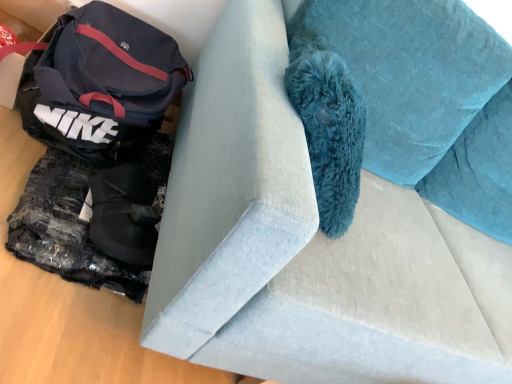
Question: From a real-world perspective, is matte black bag at left beneath suede couch at center?

Choices:
 (A) no
 (B) yes

Answer: (B)

Question: Is matte black bag at left not close to suede couch at center?

Choices:
 (A) yes
 (B) no

Answer: (B)

Question: From a real-world perspective, is matte black bag at left positioned over suede couch at center based on gravity?

Choices:
 (A) yes
 (B) no

Answer: (B)

Question: Is matte black bag at left bigger than suede couch at center?

Choices:
 (A) yes
 (B) no

Answer: (B)

Question: Could you tell me if matte black bag at left is facing suede couch at center?

Choices:
 (A) no
 (B) yes

Answer: (A)

Question: Is matte black bag at left closer to the viewer compared to suede couch at center?

Choices:
 (A) yes
 (B) no

Answer: (B)

Question: Does suede couch at center have a greater width compared to matte black bag at left?

Choices:
 (A) no
 (B) yes

Answer: (B)

Question: Is the depth of suede couch at center greater than that of matte black bag at left?

Choices:
 (A) yes
 (B) no

Answer: (B)

Question: Considering the relative sizes of suede couch at center and matte black bag at left in the image provided, is suede couch at center bigger than matte black bag at left?

Choices:
 (A) no
 (B) yes

Answer: (B)

Question: From the image's perspective, is suede couch at center above matte black bag at left?

Choices:
 (A) no
 (B) yes

Answer: (A)

Question: Are suede couch at center and matte black bag at left making contact?

Choices:
 (A) yes
 (B) no

Answer: (B)

Question: Is suede couch at center smaller than matte black bag at left?

Choices:
 (A) no
 (B) yes

Answer: (A)

Question: From the image's perspective, relative to matte black bag at left, is suede couch at center above or below?

Choices:
 (A) above
 (B) below

Answer: (B)